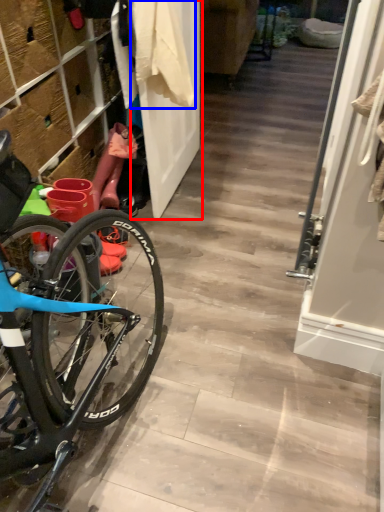
Question: Which of the following is the closest to the observer, door (highlighted by a red box) or clothing (highlighted by a blue box)?

Choices:
 (A) door
 (B) clothing

Answer: (B)